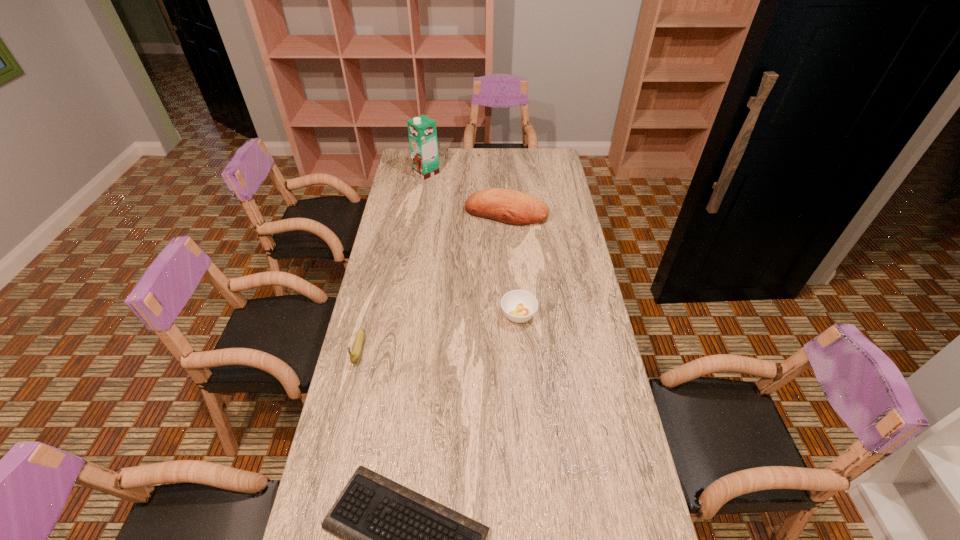
You are a GUI agent. You are given a task and a screenshot of the screen. Output one action in this format:
    pyautogui.click(x=<x>, y=<y>)
    Task: Click on the vacant space located at the stem of the leftmost object
    The width and height of the screenshot is (960, 540).
    Given the screenshot: What is the action you would take?
    pyautogui.click(x=344, y=411)

In order to click on vacant space located 0.280m on the left of the third shortest object in this screenshot , I will do `click(420, 315)`.

Find the location of `blank space located on the front-facing side of the spectacles`. blank space located on the front-facing side of the spectacles is located at coordinates (596, 530).

At what (x,y) coordinates should I click in order to perform the action: click on object that is at the far edge. Please return your answer as a coordinate pair (x, y). The image size is (960, 540). Looking at the image, I should click on (422, 132).

This screenshot has height=540, width=960. I want to click on carton that is positioned at the left edge, so click(422, 132).

The height and width of the screenshot is (540, 960). I want to click on banana that is at the left edge, so click(354, 357).

Find the location of `bread that is at the right edge`. bread that is at the right edge is located at coordinates (512, 207).

Find the location of a particular element. spectacles that is positioned at the right edge is located at coordinates (573, 469).

The image size is (960, 540). What are the coordinates of `object located at the far left corner` in the screenshot? It's located at (422, 132).

Locate an element on the screen. vacant space at the far edge of the desktop is located at coordinates (526, 163).